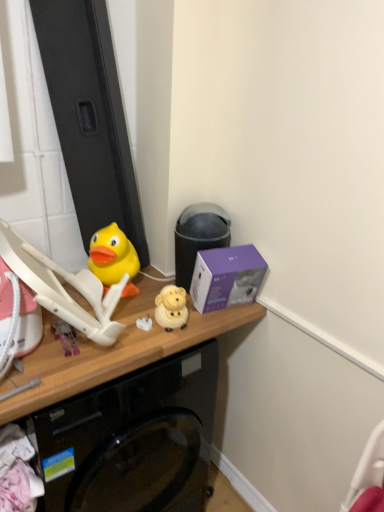
Question: Is wooden desk at center wider or thinner than yellow matte sheep at center, marked as the fourth toy in a left-to-right arrangement?

Choices:
 (A) thin
 (B) wide

Answer: (B)

Question: In the image, is wooden desk at center positioned in front of or behind yellow matte sheep at center, marked as the fourth toy in a left-to-right arrangement?

Choices:
 (A) front
 (B) behind

Answer: (A)

Question: Considering the real-world distances, which object is closest to the pink plastic toy at lower left, the 1th toy viewed from the left?

Choices:
 (A) yellow matte sheep at center, marked as the fourth toy in a left-to-right arrangement
 (B) purple matte box at upper right
 (C) white matte plug at center, which appears as the third toy when viewed from the left
 (D) matte black trash can at center
 (E) wooden desk at center

Answer: (E)

Question: Which of these objects is positioned closest to the yellow matte sheep at center, marked as the fourth toy in a left-to-right arrangement?

Choices:
 (A) white matte plug at center, which is the 2th toy from right to left
 (B) wooden desk at center
 (C) purple matte box at upper right
 (D) pink plastic toy at lower left, the 1th toy viewed from the left
 (E) yellow rubber duck at left, which is counted as the third toy, starting from the right

Answer: (A)